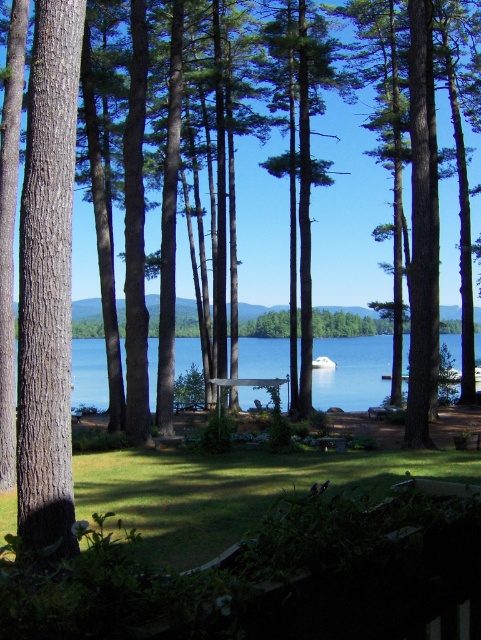
You are planning to set up a picnic at the lakeside. You have a picnic blanket that is 2 meters wide. The wooden picnic table at center is located in the middle of the area. Can the picnic blanket fit entirely on the blue water at center without overlapping the table?

The blue water at center has a larger width than the wooden picnic table at center. Since the picnic blanket is 2 meters wide, it can fit entirely on the blue water at center without overlapping the table as the water is wider than the table.

You are planning to set up a picnic at the lakeside and need to choose between placing your blanket on the blue water at center or the wooden picnic table at center. Which location is higher and thus less likely to be flooded during rain?

The blue water at center has a greater height compared to the wooden picnic table at center, so placing the blanket on the wooden picnic table at center would be less likely to flood during rain.